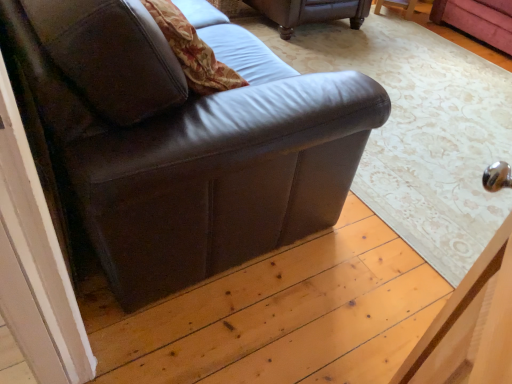
At what (x,y) coordinates should I click in order to perform the action: click on brown leather couch at upper center, which is counted as the 1th studio couch, starting from the back. Please return your answer as a coordinate pair (x, y). The image size is (512, 384). Looking at the image, I should click on (x=310, y=12).

Describe the element at coordinates (310, 12) in the screenshot. I see `brown leather couch at upper center, which ranks as the 2th studio couch in front-to-back order` at that location.

What do you see at coordinates (186, 141) in the screenshot?
I see `matte brown leather couch at left, the first studio couch positioned from the front` at bounding box center [186, 141].

I want to click on matte brown leather couch at left, which is the 2th studio couch from back to front, so click(186, 141).

The height and width of the screenshot is (384, 512). Find the location of `brown leather couch at upper center, which is counted as the 1th studio couch, starting from the back`. brown leather couch at upper center, which is counted as the 1th studio couch, starting from the back is located at coordinates (310, 12).

Is brown leather couch at upper center, which is counted as the 1th studio couch, starting from the back, at the left side of matte brown leather couch at left, which is the 2th studio couch from back to front?

In fact, brown leather couch at upper center, which is counted as the 1th studio couch, starting from the back, is to the right of matte brown leather couch at left, which is the 2th studio couch from back to front.

Does brown leather couch at upper center, which is counted as the 1th studio couch, starting from the back, lie behind matte brown leather couch at left, the first studio couch positioned from the front?

Yes.

Which point is more forward, (324, 4) or (217, 135)?

Positioned in front is point (217, 135).

From the image's perspective, is brown leather couch at upper center, which ranks as the 2th studio couch in front-to-back order, above or below matte brown leather couch at left, which is the 2th studio couch from back to front?

brown leather couch at upper center, which ranks as the 2th studio couch in front-to-back order, is above matte brown leather couch at left, which is the 2th studio couch from back to front.

From a real-world perspective, which is physically below, brown leather couch at upper center, which is counted as the 1th studio couch, starting from the back, or matte brown leather couch at left, which is the 2th studio couch from back to front?

brown leather couch at upper center, which is counted as the 1th studio couch, starting from the back, from a real-world perspective.

Does brown leather couch at upper center, which ranks as the 2th studio couch in front-to-back order, have a lesser width compared to matte brown leather couch at left, the first studio couch positioned from the front?

In fact, brown leather couch at upper center, which ranks as the 2th studio couch in front-to-back order, might be wider than matte brown leather couch at left, the first studio couch positioned from the front.

Considering the relative sizes of brown leather couch at upper center, which ranks as the 2th studio couch in front-to-back order, and matte brown leather couch at left, the first studio couch positioned from the front, in the image provided, is brown leather couch at upper center, which ranks as the 2th studio couch in front-to-back order, shorter than matte brown leather couch at left, the first studio couch positioned from the front,?

Correct, brown leather couch at upper center, which ranks as the 2th studio couch in front-to-back order, is not as tall as matte brown leather couch at left, the first studio couch positioned from the front.

Who is smaller, brown leather couch at upper center, which ranks as the 2th studio couch in front-to-back order, or matte brown leather couch at left, which is the 2th studio couch from back to front?

With smaller size is brown leather couch at upper center, which ranks as the 2th studio couch in front-to-back order.

Is brown leather couch at upper center, which ranks as the 2th studio couch in front-to-back order, surrounding matte brown leather couch at left, which is the 2th studio couch from back to front?

Actually, matte brown leather couch at left, which is the 2th studio couch from back to front, is outside brown leather couch at upper center, which ranks as the 2th studio couch in front-to-back order.

From the picture: Are brown leather couch at upper center, which ranks as the 2th studio couch in front-to-back order, and matte brown leather couch at left, which is the 2th studio couch from back to front, far apart?

That's right, there is a large distance between brown leather couch at upper center, which ranks as the 2th studio couch in front-to-back order, and matte brown leather couch at left, which is the 2th studio couch from back to front.

Is brown leather couch at upper center, which is counted as the 1th studio couch, starting from the back, looking in the opposite direction of matte brown leather couch at left, which is the 2th studio couch from back to front?

That's not correct — brown leather couch at upper center, which is counted as the 1th studio couch, starting from the back, is not looking away from matte brown leather couch at left, which is the 2th studio couch from back to front.

Measure the distance between brown leather couch at upper center, which ranks as the 2th studio couch in front-to-back order, and matte brown leather couch at left, the first studio couch positioned from the front.

They are 6.79 feet apart.

The height and width of the screenshot is (384, 512). Identify the location of studio couch above the matte brown leather couch at left, which is the 2th studio couch from back to front (from the image's perspective). (310, 12).

In the scene shown: Between matte brown leather couch at left, the first studio couch positioned from the front, and brown leather couch at upper center, which is counted as the 1th studio couch, starting from the back, which one appears on the left side from the viewer's perspective?

From the viewer's perspective, matte brown leather couch at left, the first studio couch positioned from the front, appears more on the left side.

Is the position of matte brown leather couch at left, which is the 2th studio couch from back to front, less distant than that of brown leather couch at upper center, which is counted as the 1th studio couch, starting from the back?

Yes, the depth of matte brown leather couch at left, which is the 2th studio couch from back to front, is less than that of brown leather couch at upper center, which is counted as the 1th studio couch, starting from the back.

Which is closer, (117, 78) or (352, 8)?

The point (117, 78) is in front.

From the image's perspective, is matte brown leather couch at left, which is the 2th studio couch from back to front, on brown leather couch at upper center, which is counted as the 1th studio couch, starting from the back?

No, from the image's perspective, matte brown leather couch at left, which is the 2th studio couch from back to front, is not over brown leather couch at upper center, which is counted as the 1th studio couch, starting from the back.

From a real-world perspective, is matte brown leather couch at left, which is the 2th studio couch from back to front, physically below brown leather couch at upper center, which ranks as the 2th studio couch in front-to-back order?

Actually, matte brown leather couch at left, which is the 2th studio couch from back to front, is physically above brown leather couch at upper center, which ranks as the 2th studio couch in front-to-back order, in the real world.

In terms of width, does matte brown leather couch at left, the first studio couch positioned from the front, look wider or thinner when compared to brown leather couch at upper center, which is counted as the 1th studio couch, starting from the back?

Clearly, matte brown leather couch at left, the first studio couch positioned from the front, has less width compared to brown leather couch at upper center, which is counted as the 1th studio couch, starting from the back.

Which of these two, matte brown leather couch at left, which is the 2th studio couch from back to front, or brown leather couch at upper center, which is counted as the 1th studio couch, starting from the back, stands taller?

matte brown leather couch at left, which is the 2th studio couch from back to front.

Looking at the image, does matte brown leather couch at left, the first studio couch positioned from the front, seem bigger or smaller compared to brown leather couch at upper center, which is counted as the 1th studio couch, starting from the back?

Considering their sizes, matte brown leather couch at left, the first studio couch positioned from the front, takes up more space than brown leather couch at upper center, which is counted as the 1th studio couch, starting from the back.

Would you say matte brown leather couch at left, the first studio couch positioned from the front, is outside brown leather couch at upper center, which ranks as the 2th studio couch in front-to-back order?

Indeed, matte brown leather couch at left, the first studio couch positioned from the front, is completely outside brown leather couch at upper center, which ranks as the 2th studio couch in front-to-back order.

Is matte brown leather couch at left, the first studio couch positioned from the front, positioned far away from brown leather couch at upper center, which is counted as the 1th studio couch, starting from the back?

Yes, matte brown leather couch at left, the first studio couch positioned from the front, is far from brown leather couch at upper center, which is counted as the 1th studio couch, starting from the back.

Is matte brown leather couch at left, which is the 2th studio couch from back to front, turned away from brown leather couch at upper center, which ranks as the 2th studio couch in front-to-back order?

No, brown leather couch at upper center, which ranks as the 2th studio couch in front-to-back order, is not at the back of matte brown leather couch at left, which is the 2th studio couch from back to front.

What's the angular difference between matte brown leather couch at left, which is the 2th studio couch from back to front, and brown leather couch at upper center, which ranks as the 2th studio couch in front-to-back order,'s facing directions?

They differ by 89.4 degrees in their facing directions.

How much distance is there between matte brown leather couch at left, which is the 2th studio couch from back to front, and brown leather couch at upper center, which ranks as the 2th studio couch in front-to-back order?

The distance of matte brown leather couch at left, which is the 2th studio couch from back to front, from brown leather couch at upper center, which ranks as the 2th studio couch in front-to-back order, is 2.07 meters.

The height and width of the screenshot is (384, 512). There is a brown leather couch at upper center, which is counted as the 1th studio couch, starting from the back. Find the location of `studio couch above it (from a real-world perspective)`. studio couch above it (from a real-world perspective) is located at coordinates (186, 141).

Where is `studio couch lying behind the matte brown leather couch at left, which is the 2th studio couch from back to front`? This screenshot has width=512, height=384. studio couch lying behind the matte brown leather couch at left, which is the 2th studio couch from back to front is located at coordinates (310, 12).

Where is `studio couch to the left of brown leather couch at upper center, which is counted as the 1th studio couch, starting from the back`? The height and width of the screenshot is (384, 512). studio couch to the left of brown leather couch at upper center, which is counted as the 1th studio couch, starting from the back is located at coordinates (186, 141).